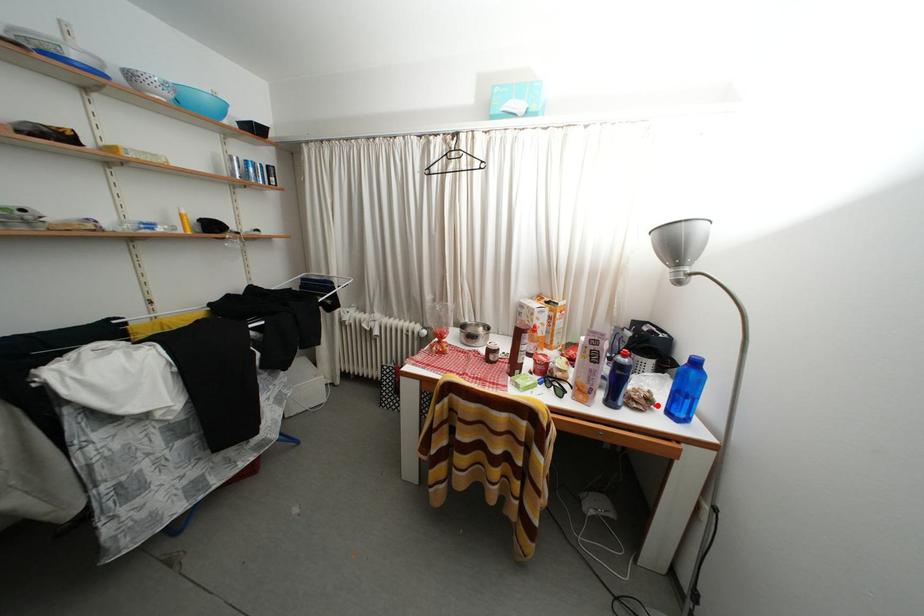
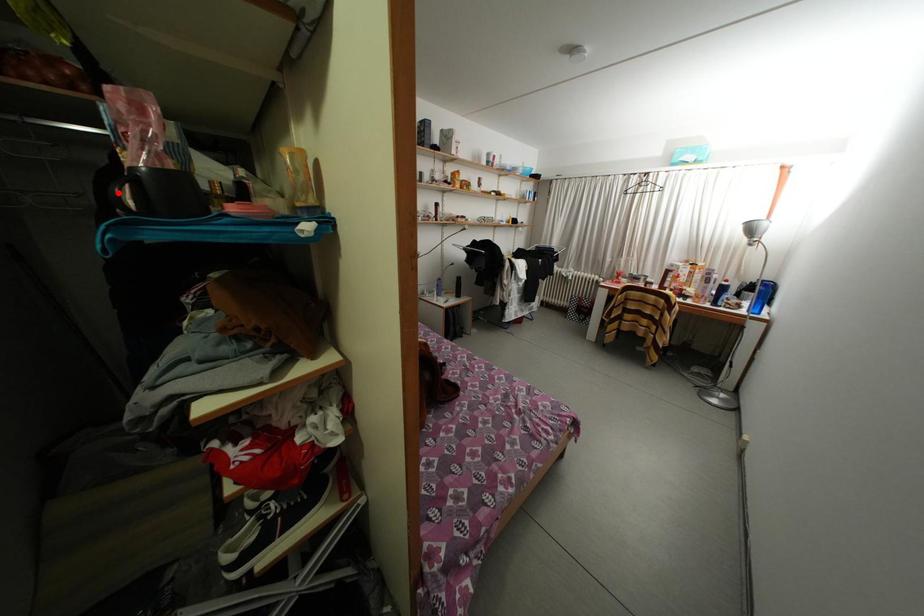
I am providing you with two images of the same scene from different viewpoints. A red point is marked on the first image and another point is marked on the second image. Is the marked point in image1 the same physical position as the marked point in image2?

No